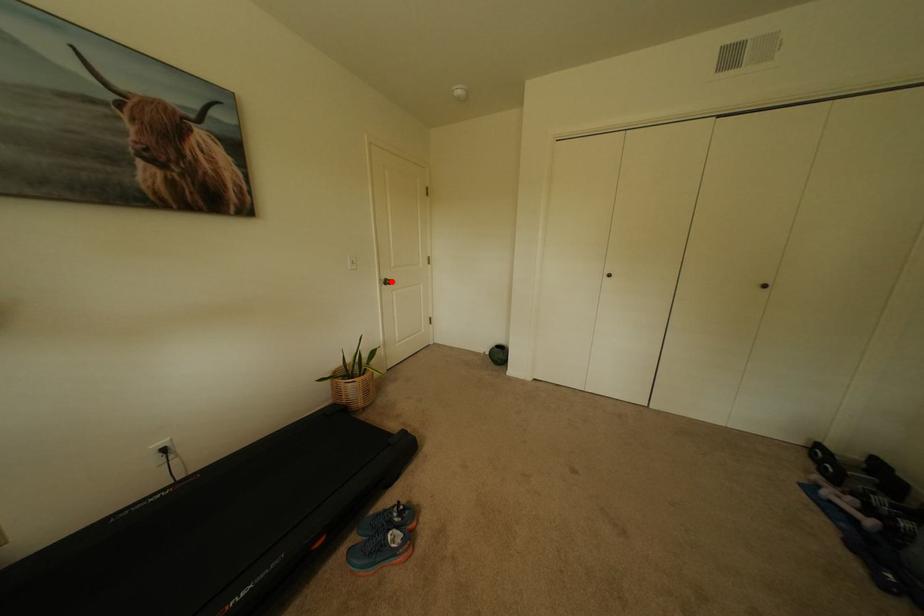
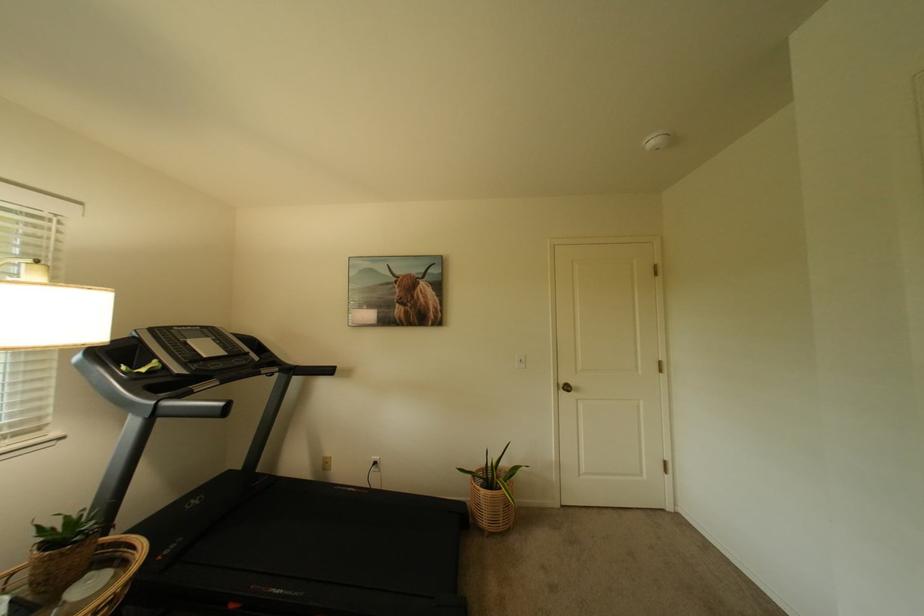
In the second image, find the point that corresponds to the highlighted location in the first image.

(569, 386)